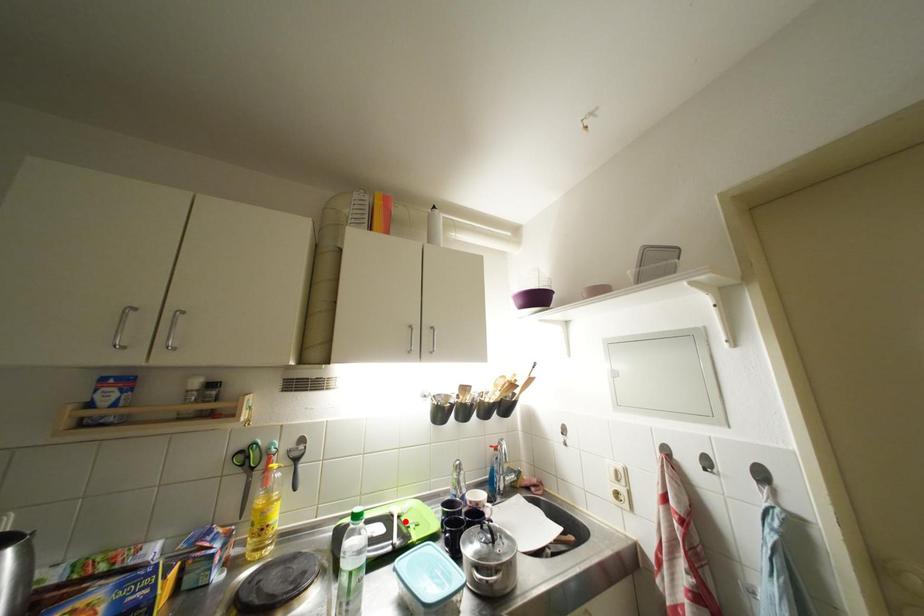
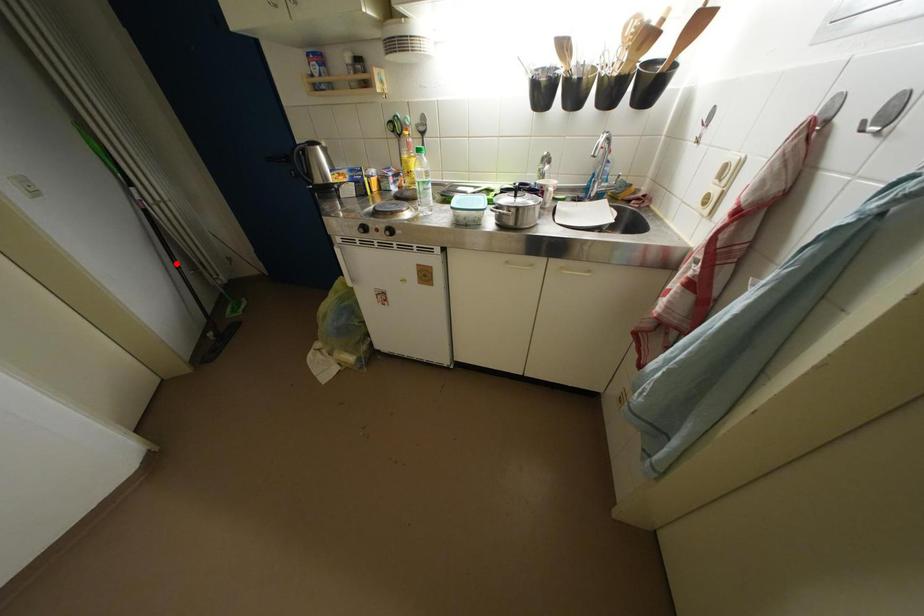
I am providing you with two images of the same scene from different viewpoints. A red point is marked on the first image and another point is marked on the second image. Do the highlighted points in image1 and image2 indicate the same real-world spot?

No